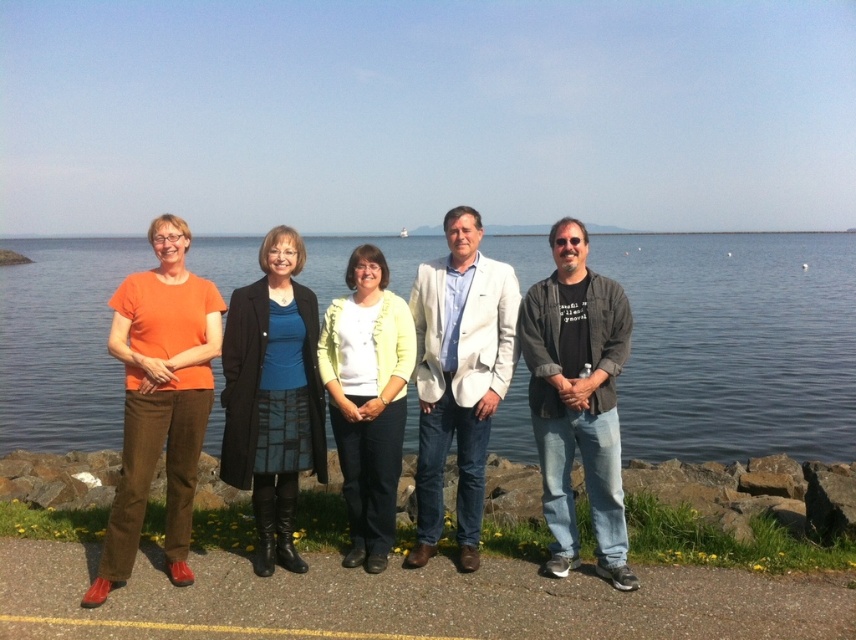
From the picture: Where is the orange cotton shirt at left located in the image?

The orange cotton shirt at left is located at point (x=159, y=400) in the image.

You are a photographer setting up for a group photo. You notice the orange cotton shirt at left and the blue silk blouse at center. Which person should you ask to stand on a small stool to ensure both are at eye level?

The orange cotton shirt at left has a lesser height compared to blue silk blouse at center, so you should ask the person wearing the orange cotton shirt at left to stand on a small stool to balance their heights.

Based on the scene description, where is the white textured blazer at center located in terms of coordinates?

The white textured blazer at center is located at coordinates point (459, 378).